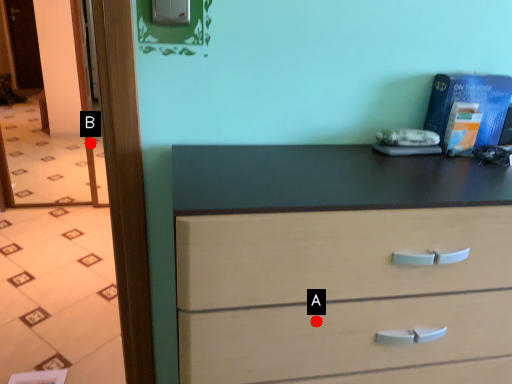
Question: Two points are circled on the image, labeled by A and B beside each circle. Which point is farther to the camera?

Choices:
 (A) A is further
 (B) B is further

Answer: (B)